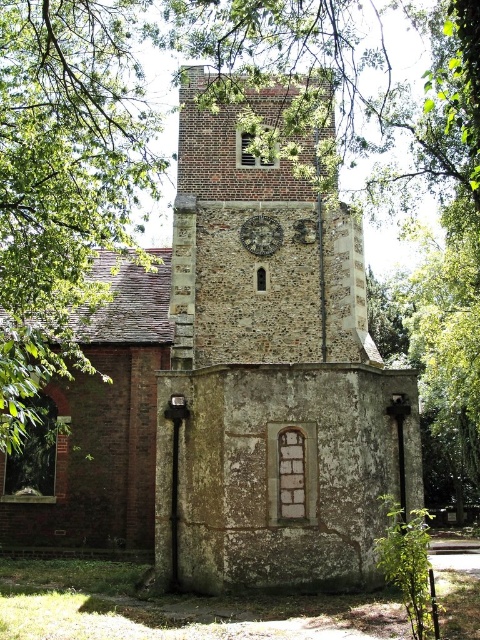
Question: Does stone clock tower at center have a greater width compared to rustic stone clock at center?

Choices:
 (A) no
 (B) yes

Answer: (B)

Question: Can you confirm if stone clock tower at center is smaller than rustic stone clock at center?

Choices:
 (A) yes
 (B) no

Answer: (B)

Question: Does stone clock tower at center have a larger size compared to rustic stone clock at center?

Choices:
 (A) yes
 (B) no

Answer: (A)